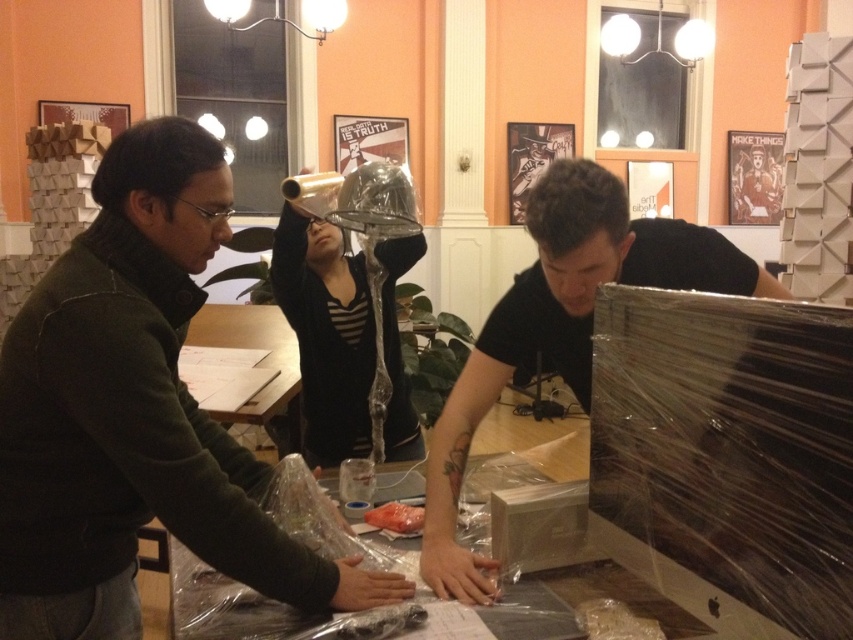
Between matte black jacket at left and clear plastic table at center, which one appears on the right side from the viewer's perspective?

clear plastic table at center is more to the right.

Is matte black jacket at left smaller than clear plastic table at center?

No.

Locate an element on the screen. This screenshot has height=640, width=853. matte black jacket at left is located at coordinates (134, 413).

Is matte black jacket at left wider than matte black shirt at center?

In fact, matte black jacket at left might be narrower than matte black shirt at center.

Based on the photo, who is shorter, matte black jacket at left or matte black shirt at center?

With less height is matte black shirt at center.

Image resolution: width=853 pixels, height=640 pixels. What do you see at coordinates (134, 413) in the screenshot? I see `matte black jacket at left` at bounding box center [134, 413].

Find the location of a particular element. matte black jacket at left is located at coordinates (134, 413).

Based on the photo, is clear plastic bag at center in front of clear plastic table at center?

That is False.

Is point (358, 436) behind point (189, 582)?

That is True.

The image size is (853, 640). What are the coordinates of `clear plastic bag at center` in the screenshot? It's located at (344, 333).